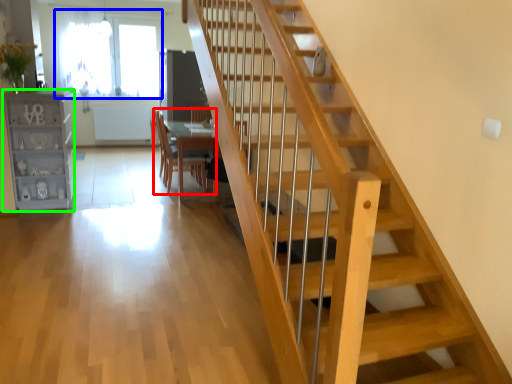
Question: Considering the real-world distances, which object is closest to chair (highlighted by a red box)? window (highlighted by a blue box) or bookshelf (highlighted by a green box).

Choices:
 (A) window
 (B) bookshelf

Answer: (B)